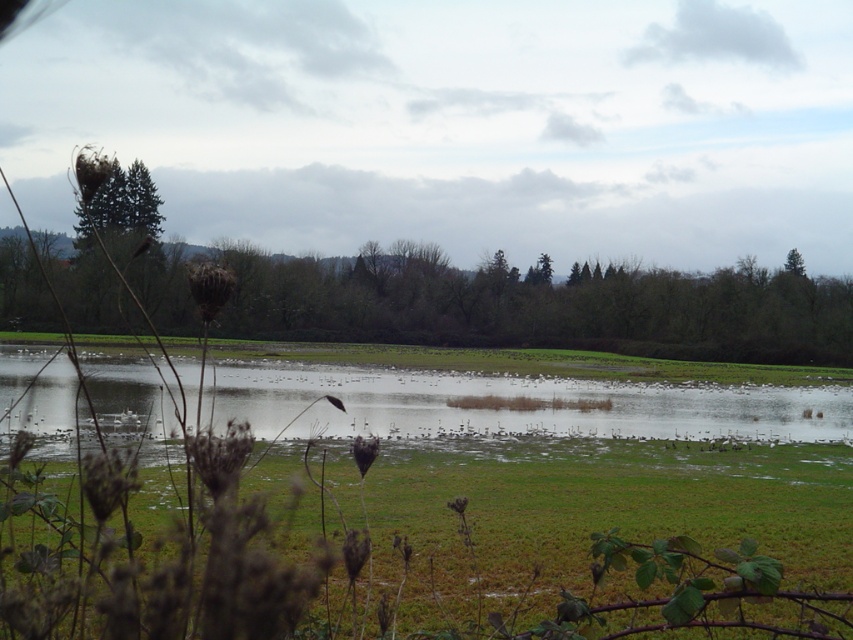
You are standing at the edge of a pond and want to place a 2.5 meter long wooden board from your current position to the green grass at center. Will the board be long enough to reach the grass?

The distance between you and the green grass at center is 2.21 meters, so the 2.5 meter long wooden board will be long enough to reach the grass.

You are standing in the natural landscape and want to take a photo of the green leafy tree at left without the green grass at center blocking the view. How should you position yourself to achieve this?

To avoid the green grass at center blocking the view of the green leafy tree at left, you should move further back so that the green grass at center is no longer in front of the tree. Since the green grass at center is currently in front of the green leafy tree at left, moving backward will create more distance between you and the scene, allowing the grass to appear behind or beside the tree in your photo.